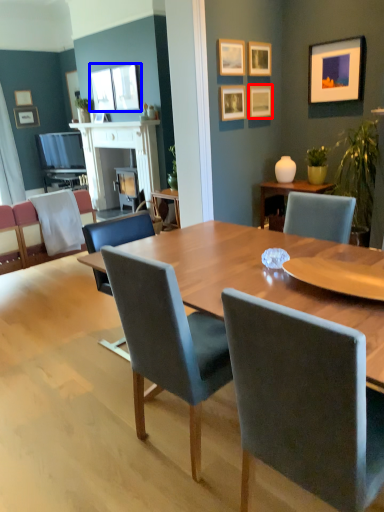
Question: Which object appears closest to the camera in this image, picture frame (highlighted by a red box) or picture frame (highlighted by a blue box)?

Choices:
 (A) picture frame
 (B) picture frame

Answer: (A)